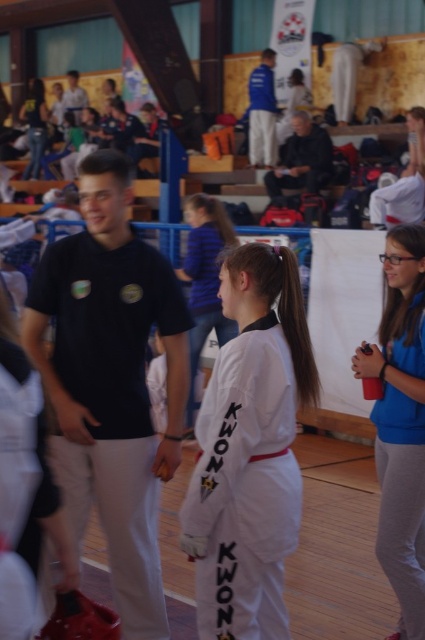
Question: Observing the image, what is the correct spatial positioning of white matte karate uniform at center in reference to matte black karate uniform at upper left?

Choices:
 (A) above
 (B) below

Answer: (B)

Question: Which point is closer to the camera?

Choices:
 (A) (34, 131)
 (B) (390, 474)

Answer: (B)

Question: Which of the following is the farthest from the observer?

Choices:
 (A) matte black karate uniform at upper left
 (B) blue fabric shirt at right

Answer: (A)

Question: Can you confirm if white matte karate uniform at center is positioned below blue fabric shirt at right?

Choices:
 (A) no
 (B) yes

Answer: (A)

Question: Is white matte karate uniform at center positioned behind matte black karate uniform at upper left?

Choices:
 (A) no
 (B) yes

Answer: (A)

Question: Which point is farther to the camera?

Choices:
 (A) (419, 620)
 (B) (226, 268)

Answer: (A)